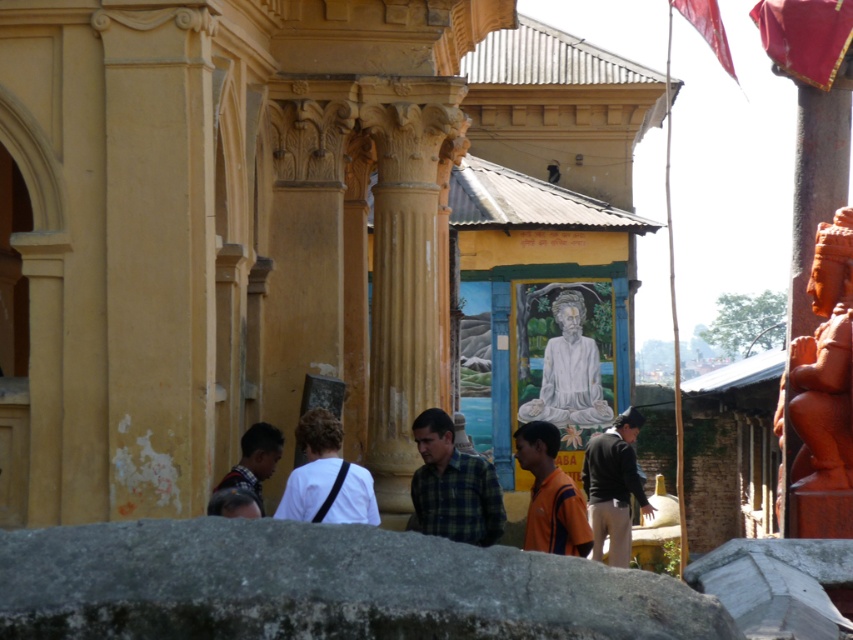
In the scene shown: Between matte orange statue at right and orange fabric shirt at center, which one has less height?

Standing shorter between the two is orange fabric shirt at center.

Can you confirm if matte orange statue at right is positioned to the right of orange fabric shirt at center?

Yes, matte orange statue at right is to the right of orange fabric shirt at center.

Is point (799, 484) farther from viewer compared to point (558, 477)?

No, (799, 484) is in front of (558, 477).

Where is `matte orange statue at right`? matte orange statue at right is located at coordinates (824, 392).

Who is higher up, matte orange statue at right or plaid fabric shirt at center?

matte orange statue at right is higher up.

Is point (798, 400) farther from viewer compared to point (416, 435)?

No.

Between point (822, 250) and point (469, 468), which one is positioned in front?

Point (822, 250)

The width and height of the screenshot is (853, 640). I want to click on matte orange statue at right, so click(824, 392).

Is matte orange statue at right thinner than white matte shirt at center?

Correct, matte orange statue at right's width is less than white matte shirt at center's.

Can you confirm if matte orange statue at right is positioned to the left of white matte shirt at center?

Incorrect, matte orange statue at right is not on the left side of white matte shirt at center.

Between point (827, 328) and point (335, 442), which one is positioned behind?

Positioned behind is point (335, 442).

At what (x,y) coordinates should I click in order to perform the action: click on matte orange statue at right. Please return your answer as a coordinate pair (x, y). This screenshot has width=853, height=640. Looking at the image, I should click on (824, 392).